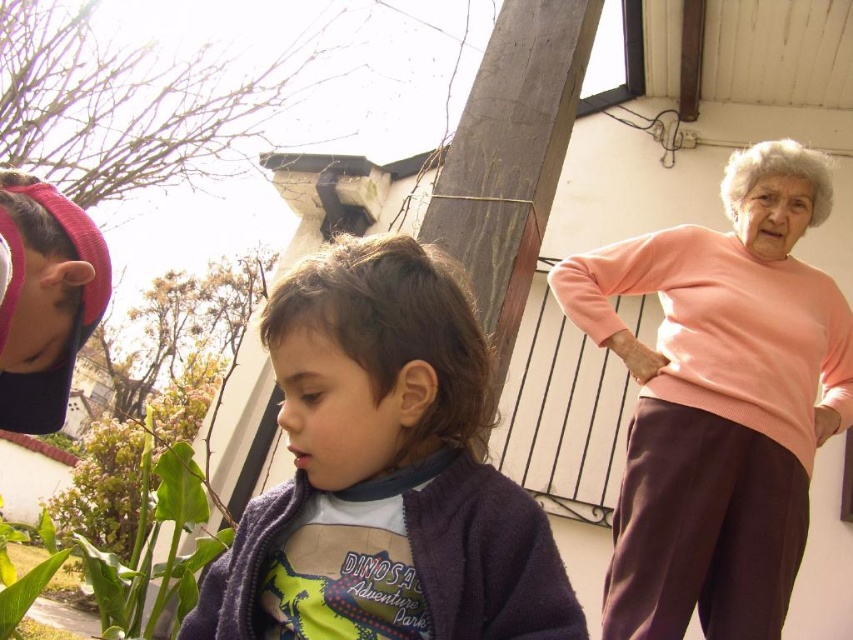
Question: Can you confirm if purple fleece jacket at center is bigger than pink fabric cap at upper left?

Choices:
 (A) yes
 (B) no

Answer: (A)

Question: Which object appears farthest from the camera in this image?

Choices:
 (A) pink knit sweater at right
 (B) purple fleece jacket at center
 (C) green leafy plant at lower left
 (D) pink fabric cap at upper left

Answer: (C)

Question: Is pink knit sweater at right above green leafy plant at lower left?

Choices:
 (A) no
 (B) yes

Answer: (B)

Question: Estimate the real-world distances between objects in this image. Which object is farther from the green leafy plant at lower left?

Choices:
 (A) purple fleece jacket at center
 (B) pink knit sweater at right

Answer: (B)

Question: Can you confirm if purple fleece jacket at center is positioned to the left of pink fabric cap at upper left?

Choices:
 (A) no
 (B) yes

Answer: (A)

Question: Which of the following is the farthest from the observer?

Choices:
 (A) pink fabric cap at upper left
 (B) purple fleece jacket at center
 (C) pink knit sweater at right
 (D) green leafy plant at lower left

Answer: (D)